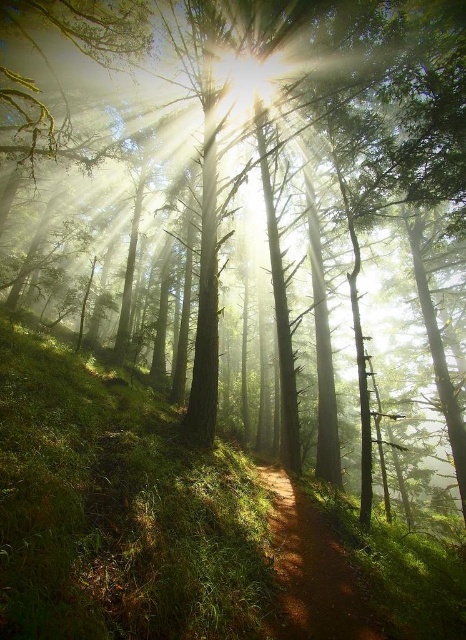
Looking at this image, measure the distance between dirt path at center and bright white light at center.

dirt path at center is 11.73 meters away from bright white light at center.

Is dirt path at center to the right of bright white light at center from the viewer's perspective?

Indeed, dirt path at center is positioned on the right side of bright white light at center.

The height and width of the screenshot is (640, 466). Identify the location of dirt path at center. (309, 570).